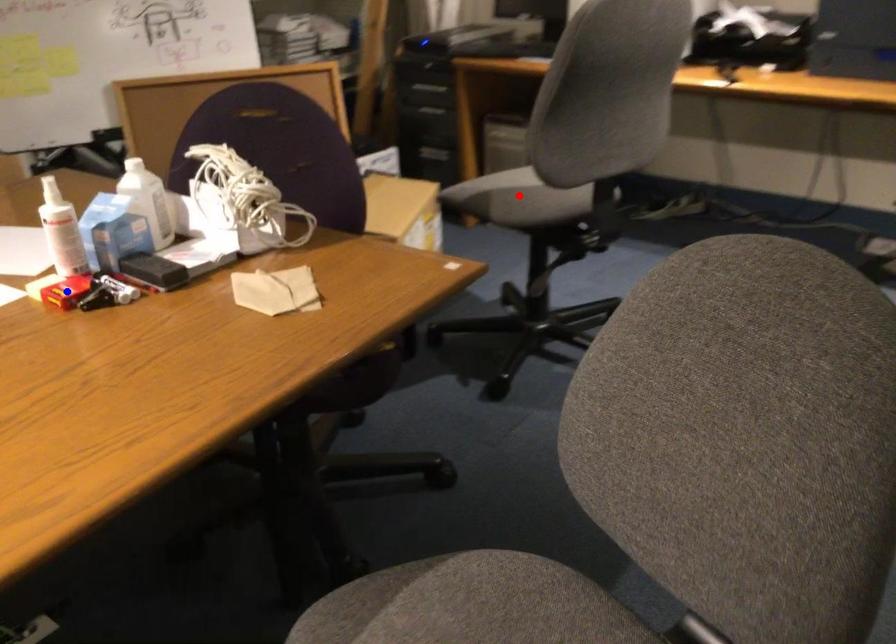
Question: In the image, two points are highlighted. Which point is nearer to the camera? Reply with the corresponding letter.

Choices:
 (A) blue point
 (B) red point

Answer: (A)